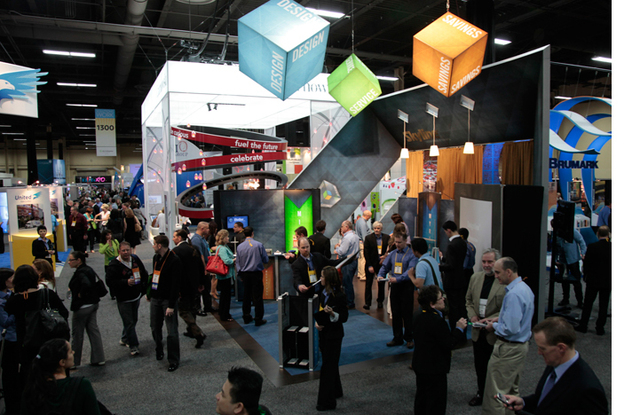
Where is `booth`? This screenshot has height=415, width=640. booth is located at coordinates (387, 170).